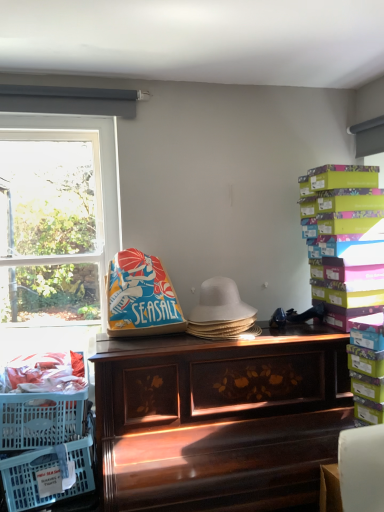
What do you see at coordinates (56, 229) in the screenshot? This screenshot has height=512, width=384. I see `white plastic window at left` at bounding box center [56, 229].

Find the location of a particular element. The height and width of the screenshot is (512, 384). white plastic window at left is located at coordinates click(56, 229).

Identify the location of multicolored cardboard boxes at right. tap(350, 268).

Where is `desk that appears below the white woven hat at center (from a real-world perspective)`? desk that appears below the white woven hat at center (from a real-world perspective) is located at coordinates point(218,419).

Is wooden piano at center taller than white woven hat at center?

Indeed, wooden piano at center has a greater height compared to white woven hat at center.

Is wooden piano at center turned away from white woven hat at center?

No, white woven hat at center is not at the back of wooden piano at center.

Is wooden piano at center far from white woven hat at center?

No, wooden piano at center is in close proximity to white woven hat at center.

Who is bigger, white woven hat at center or white plastic window at left?

white plastic window at left.

In the image, is white woven hat at center positioned in front of or behind white plastic window at left?

In the image, white woven hat at center appears in front of white plastic window at left.

Locate an element on the screen. hat directly beneath the white plastic window at left (from a real-world perspective) is located at coordinates (220, 302).

How far apart are white woven hat at center and white plastic window at left?

white woven hat at center is 89.89 centimeters from white plastic window at left.

Is wooden piano at center beside translucent plastic crate at lower left?

No, wooden piano at center is not in contact with translucent plastic crate at lower left.

Between point (274, 435) and point (54, 465), which one is positioned behind?

The point (274, 435) is farther from the camera.

From a real-world perspective, who is located lower, wooden piano at center or translucent plastic crate at lower left?

In real-world perspective, wooden piano at center is lower.

Considering the relative sizes of white plastic window at left and wooden piano at center in the image provided, is white plastic window at left wider than wooden piano at center?

No, white plastic window at left is not wider than wooden piano at center.

In terms of height, does white plastic window at left look taller or shorter compared to wooden piano at center?

Considering their sizes, white plastic window at left has less height than wooden piano at center.

Is white plastic window at left further to the viewer compared to wooden piano at center?

Yes, white plastic window at left is further from the viewer.

Which is correct: white plastic window at left is inside wooden piano at center, or outside of it?

white plastic window at left exists outside the volume of wooden piano at center.

Is white woven hat at center placed right next to translucent plastic crate at lower left?

No, white woven hat at center is not beside translucent plastic crate at lower left.

Considering the relative sizes of white woven hat at center and translucent plastic crate at lower left in the image provided, is white woven hat at center bigger than translucent plastic crate at lower left?

Incorrect, white woven hat at center is not larger than translucent plastic crate at lower left.

Considering the relative sizes of white woven hat at center and translucent plastic crate at lower left in the image provided, is white woven hat at center thinner than translucent plastic crate at lower left?

Yes.

Does point (196, 321) come closer to viewer compared to point (79, 445)?

That is False.

From the image's perspective, is white plastic window at left on top of white woven hat at center?

Yes.

Is white plastic window at left wider or thinner than white woven hat at center?

In the image, white plastic window at left appears to be more narrow than white woven hat at center.

I want to click on window above the white woven hat at center (from a real-world perspective), so click(x=56, y=229).

Does point (89, 344) come in front of point (238, 298)?

Yes, it is in front of point (238, 298).

Is wooden piano at center further to the viewer compared to white plastic window at left?

No.

Can you confirm if wooden piano at center is bigger than white plastic window at left?

Indeed, wooden piano at center has a larger size compared to white plastic window at left.

Is wooden piano at center oriented away from white plastic window at left?

No, wooden piano at center is not facing away from white plastic window at left.

Does wooden piano at center have a lesser width compared to white plastic window at left?

No, wooden piano at center is not thinner than white plastic window at left.

Where is `hat that is on the left side of wooden piano at center`? The height and width of the screenshot is (512, 384). hat that is on the left side of wooden piano at center is located at coordinates (220, 302).

The height and width of the screenshot is (512, 384). Identify the location of window above the white woven hat at center (from the image's perspective). (x=56, y=229).

Which object lies nearer to the anchor point translucent plastic crate at lower left, wooden piano at center or white plastic window at left?

wooden piano at center is closer to translucent plastic crate at lower left.

Looking at this image, considering their positions, is translucent plastic crate at lower left positioned closer to white plastic window at left than multicolored cardboard boxes at right?

Based on the image, translucent plastic crate at lower left appears to be nearer to white plastic window at left.

From the image, which object appears to be farther from white plastic window at left, wooden piano at center or multicolored cardboard boxes at right?

multicolored cardboard boxes at right.

Estimate the real-world distances between objects in this image. Which object is further from multicolored cardboard boxes at right, translucent plastic crate at lower left or white woven hat at center?

translucent plastic crate at lower left lies further to multicolored cardboard boxes at right than the other object.

Which object lies further to the anchor point wooden piano at center, multicolored cardboard boxes at right or white plastic window at left?

white plastic window at left lies further to wooden piano at center than the other object.

Which object lies further to the anchor point white woven hat at center, wooden piano at center or translucent plastic crate at lower left?

The object further to white woven hat at center is translucent plastic crate at lower left.

Estimate the real-world distances between objects in this image. Which object is closer to white plastic window at left, wooden piano at center or translucent plastic crate at lower left?

The object closer to white plastic window at left is wooden piano at center.

Looking at the image, which one is located further to wooden piano at center, white woven hat at center or white plastic window at left?

Among the two, white plastic window at left is located further to wooden piano at center.

I want to click on basket between white plastic window at left and multicolored cardboard boxes at right in the horizontal direction, so click(47, 474).

Find the location of a particular element. The width and height of the screenshot is (384, 512). hat located between translucent plastic crate at lower left and wooden piano at center in the left-right direction is located at coordinates (220, 302).

This screenshot has width=384, height=512. Find the location of `hat between multicolored cardboard boxes at right and wooden piano at center in the up-down direction`. hat between multicolored cardboard boxes at right and wooden piano at center in the up-down direction is located at coordinates (220, 302).

Find the location of a particular element. hat between white plastic window at left and translucent plastic crate at lower left vertically is located at coordinates (220, 302).